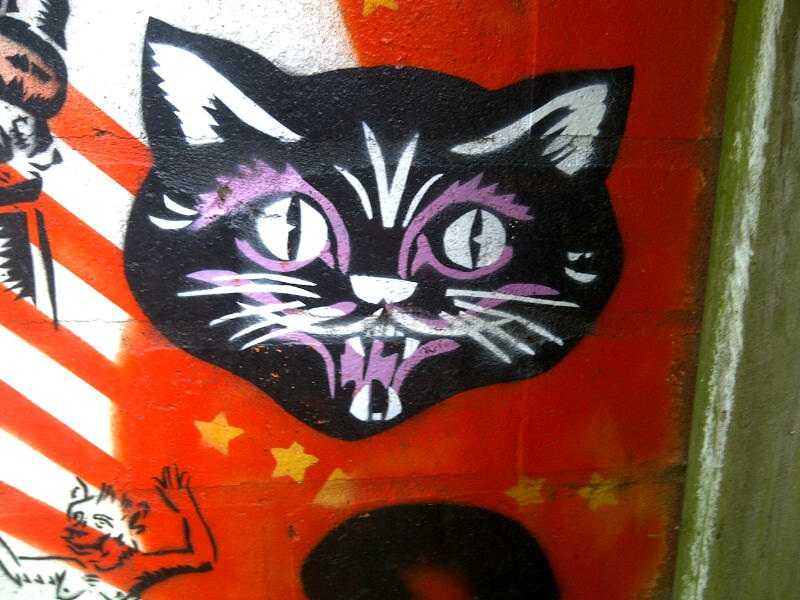
Where is `red paint`? The width and height of the screenshot is (800, 600). red paint is located at coordinates (608, 382).